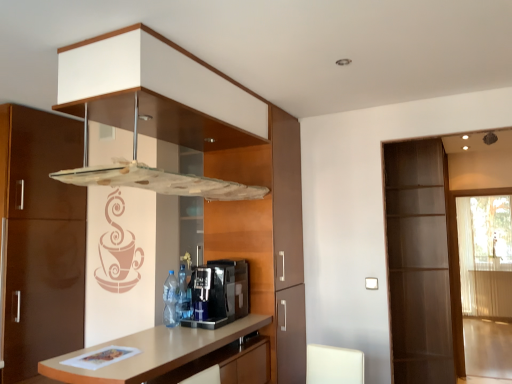
Locate an element on the screen. The image size is (512, 384). free location in front of blue plastic bottle at center, which appears as the second bottle when viewed from the front is located at coordinates (176, 330).